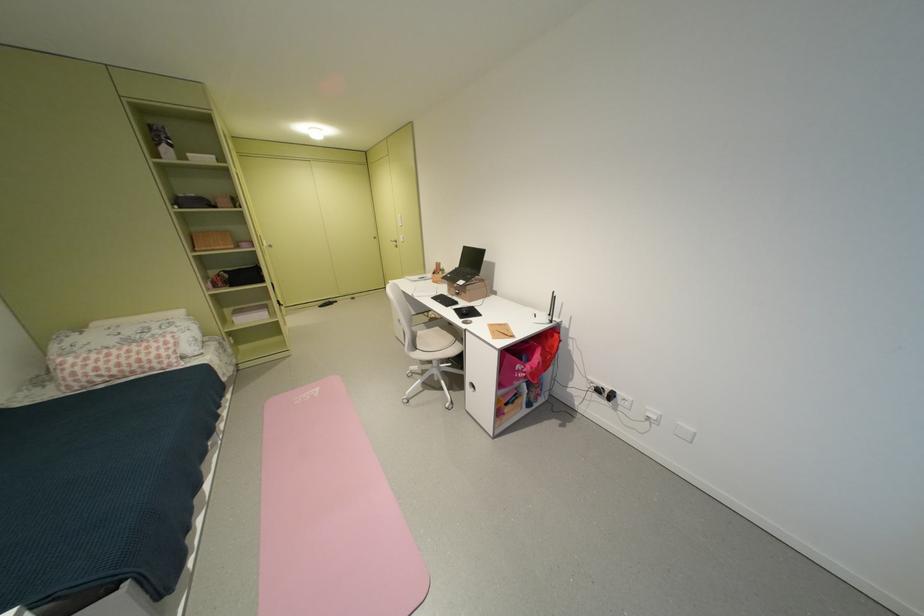
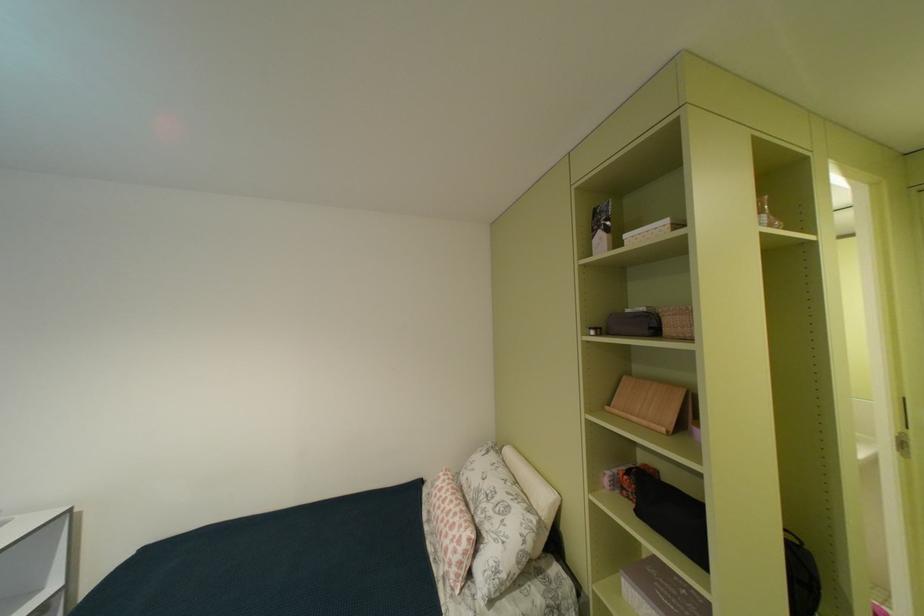
Locate, in the second image, the point that corresponds to point 234,288 in the first image.

(641, 501)